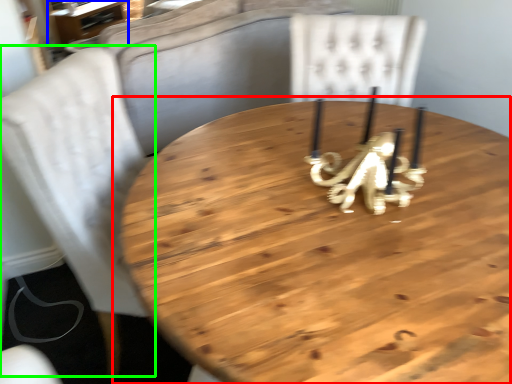
Question: Which is nearer to the table (highlighted by a red box)? table (highlighted by a blue box) or chair (highlighted by a green box).

Choices:
 (A) table
 (B) chair

Answer: (B)